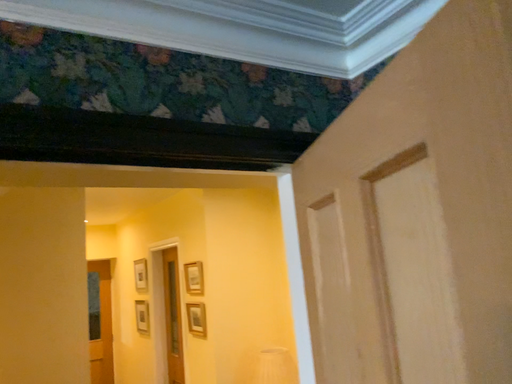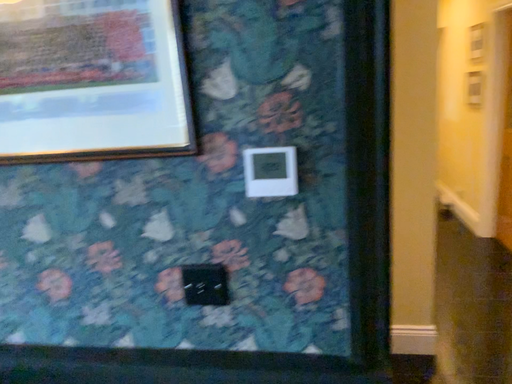
Question: How did the camera likely rotate when shooting the video?

Choices:
 (A) rotated left
 (B) rotated right

Answer: (A)